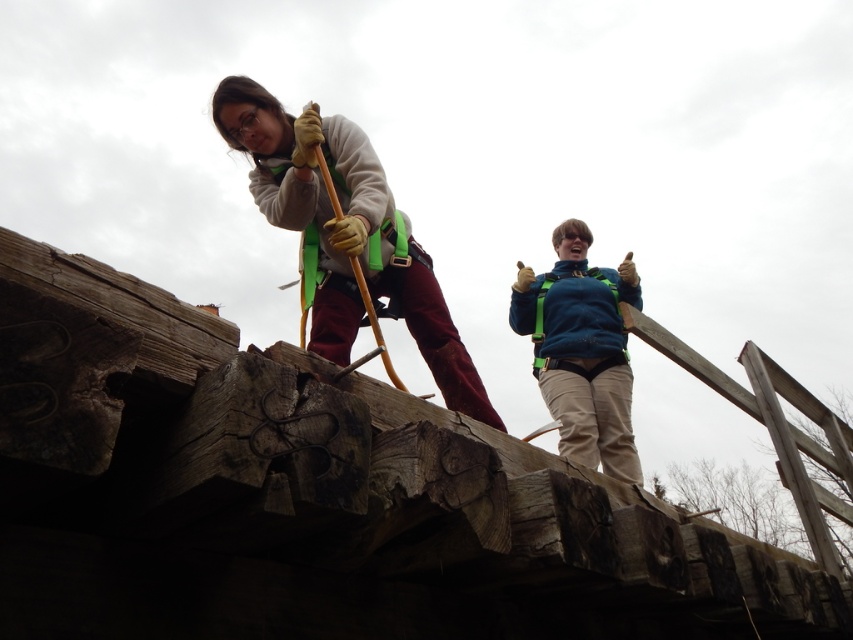
Question: Estimate the real-world distances between objects in this image. Which object is closer to the teal fabric safety vest at upper center?

Choices:
 (A) matte green safety harness at upper left
 (B) blue fleece jacket at upper center

Answer: (B)

Question: Does matte green safety harness at upper left appear over teal fabric safety vest at upper center?

Choices:
 (A) yes
 (B) no

Answer: (A)

Question: Does blue fleece jacket at upper center appear on the left side of teal fabric safety vest at upper center?

Choices:
 (A) yes
 (B) no

Answer: (A)

Question: Is matte green safety harness at upper left to the left of teal fabric safety vest at upper center from the viewer's perspective?

Choices:
 (A) yes
 (B) no

Answer: (A)

Question: Estimate the real-world distances between objects in this image. Which object is closer to the blue fleece jacket at upper center?

Choices:
 (A) teal fabric safety vest at upper center
 (B) matte green safety harness at upper left

Answer: (A)

Question: Based on their relative distances, which object is farther from the matte green safety harness at upper left?

Choices:
 (A) teal fabric safety vest at upper center
 (B) blue fleece jacket at upper center

Answer: (A)